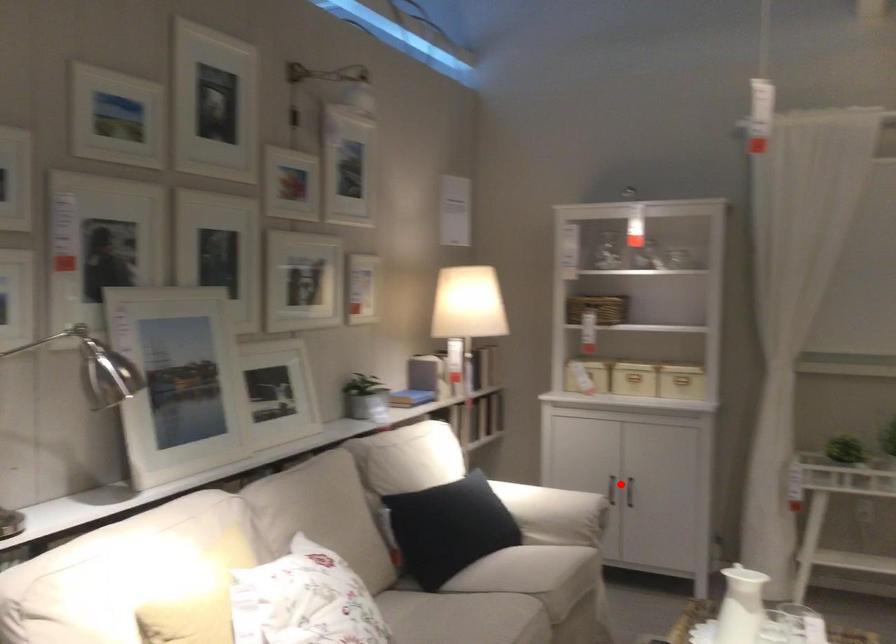
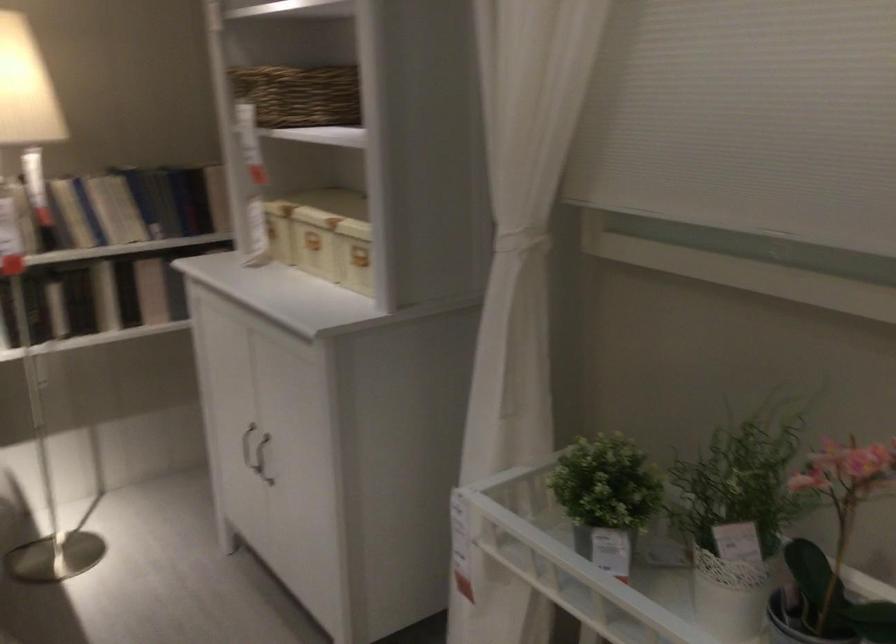
Question: I am providing you with two images of the same scene from different viewpoints. A red point is shown in image1. For the corresponding object point in image2, is it positioned nearer or farther from the camera?

Choices:
 (A) Nearer
 (B) Farther

Answer: (A)